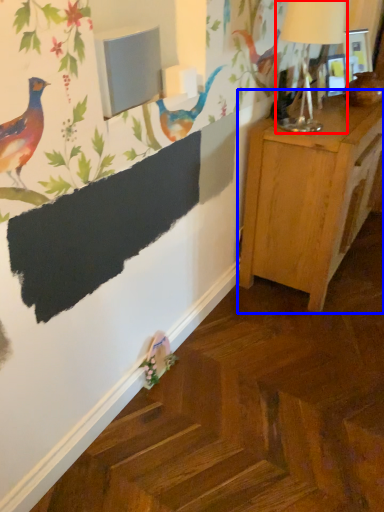
Question: Which object is further to the camera taking this photo, table lamp (highlighted by a red box) or nightstand (highlighted by a blue box)?

Choices:
 (A) table lamp
 (B) nightstand

Answer: (B)